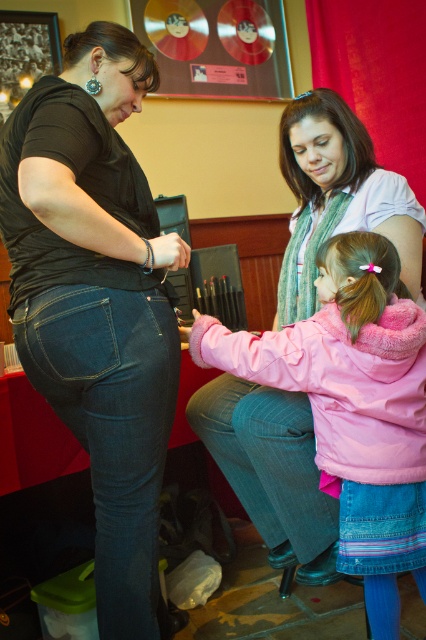
Is point (374, 497) closer to camera compared to point (362, 285)?

No, it is not.

Is pink fleece jacket at center taller than light brown silky hair at center?

Correct, pink fleece jacket at center is much taller as light brown silky hair at center.

Is point (201, 346) in front of point (331, 268)?

No.

Locate an element on the screen. This screenshot has height=640, width=426. pink fleece jacket at center is located at coordinates (354, 406).

Is the position of black matte jeans at center more distant than that of brown smooth hair at center?

No, it is in front of brown smooth hair at center.

Who is shorter, black matte jeans at center or brown smooth hair at center?

brown smooth hair at center

The width and height of the screenshot is (426, 640). Describe the element at coordinates (97, 300) in the screenshot. I see `black matte jeans at center` at that location.

What are the coordinates of `black matte jeans at center` in the screenshot? It's located at (97, 300).

Is light brown silky hair at center below dark brown shiny hair at upper left?

Indeed, light brown silky hair at center is positioned under dark brown shiny hair at upper left.

Between point (363, 298) and point (63, 56), which one is positioned in front?

Point (363, 298)

Identify the location of light brown silky hair at center. 359,276.